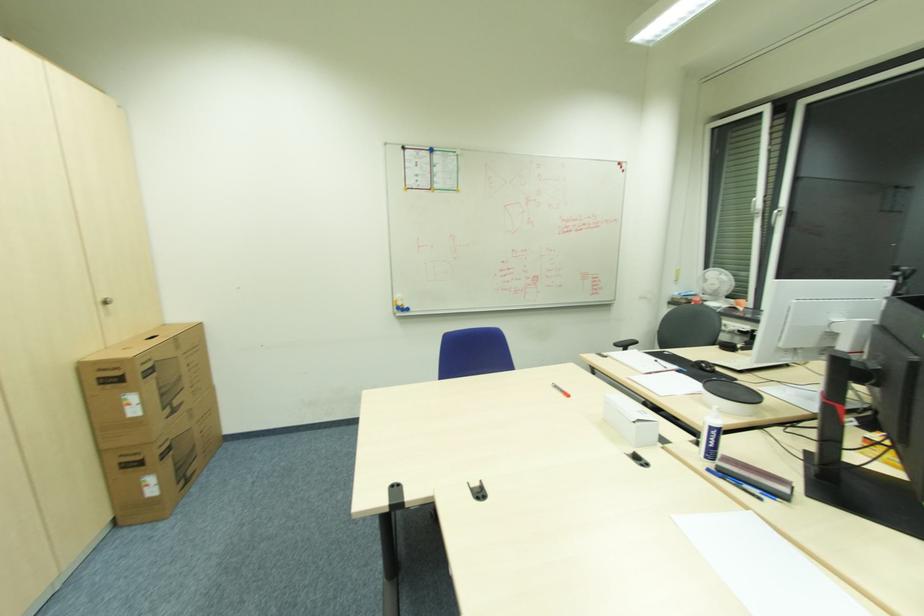
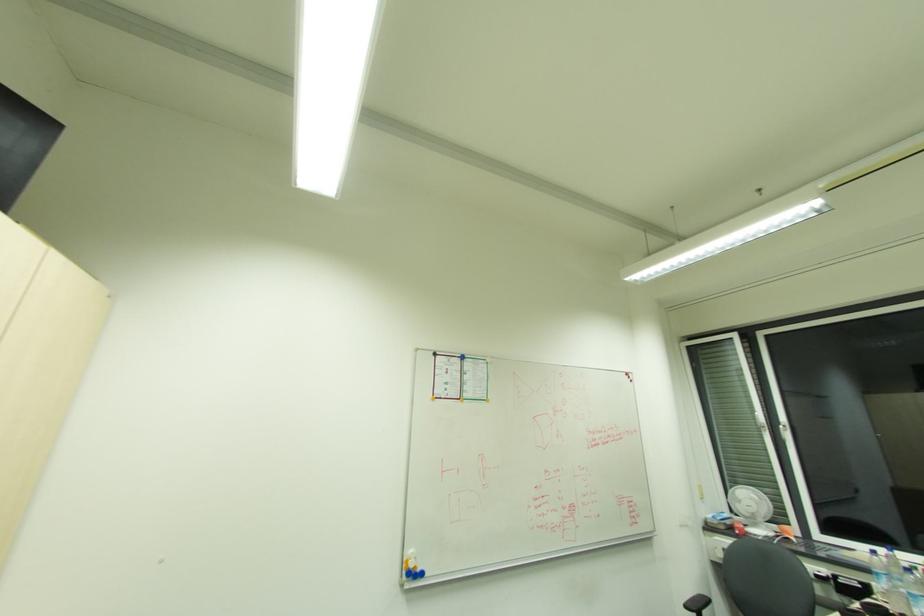
Question: How did the camera likely rotate?

Choices:
 (A) Left
 (B) Right
 (C) Up
 (D) Down

Answer: (C)